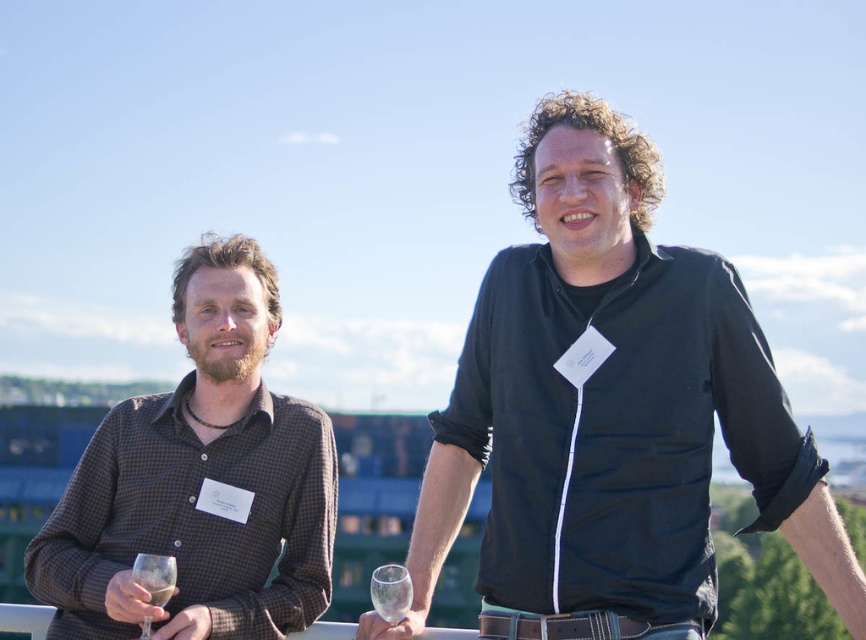
Who is lower down, brown leather belt at center or translucent glass wine at lower left?

brown leather belt at center is below.

Can you confirm if brown leather belt at center is smaller than translucent glass wine at lower left?

Yes.

Who is more forward, (638, 637) or (147, 582)?

Point (638, 637) is more forward.

The height and width of the screenshot is (640, 866). In order to click on brown leather belt at center in this screenshot , I will do `click(580, 627)`.

Is black matte shirt at center taller than brown checkered shirt at left?

Yes.

Who is positioned more to the right, black matte shirt at center or brown checkered shirt at left?

Positioned to the right is black matte shirt at center.

Between point (641, 296) and point (260, 330), which one is positioned in front?

Positioned in front is point (641, 296).

Locate an element on the screen. black matte shirt at center is located at coordinates (611, 404).

Find the location of a particular element. transparent glass at lower left is located at coordinates (154, 577).

Who is more forward, [166,584] or [169,593]?

Point [166,584] is more forward.

This screenshot has height=640, width=866. I want to click on transparent glass at lower left, so click(154, 577).